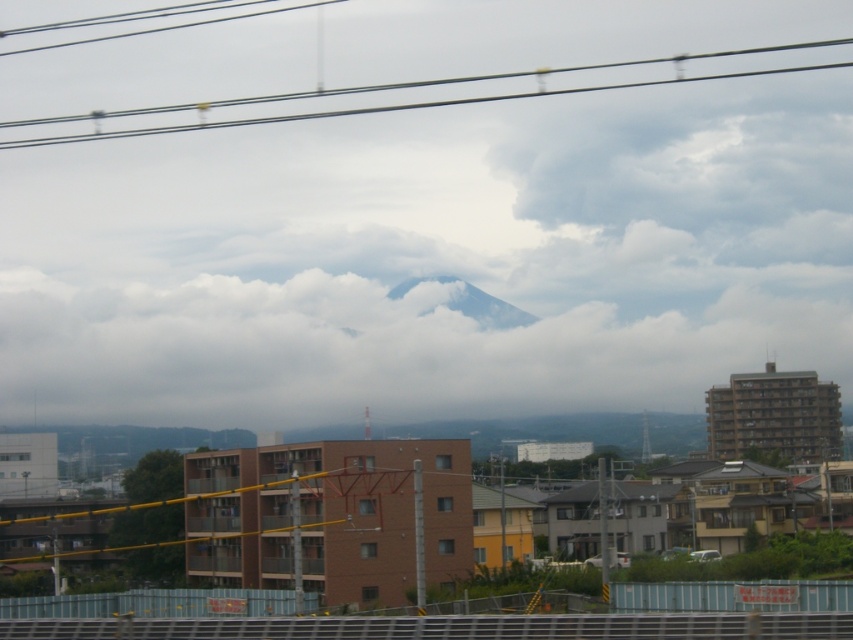
Question: Among these points, which one is nearest to the camera?

Choices:
 (A) (560, 352)
 (B) (477, 97)

Answer: (A)

Question: Can you confirm if metallic wire at upper center is wider than gray/cloudy mountain at center?

Choices:
 (A) no
 (B) yes

Answer: (B)

Question: Is metallic wire at upper center further to the viewer compared to gray/cloudy mountain at center?

Choices:
 (A) yes
 (B) no

Answer: (B)

Question: Considering the real-world distances, which object is closest to the metallic wire at upper center?

Choices:
 (A) white fluffy cloud at center
 (B) gray/cloudy mountain at center

Answer: (B)

Question: Is white fluffy cloud at center behind metallic wire at upper center?

Choices:
 (A) no
 (B) yes

Answer: (A)

Question: Which of the following is the farthest from the observer?

Choices:
 (A) (233, 122)
 (B) (123, 381)
 (C) (514, 324)

Answer: (A)